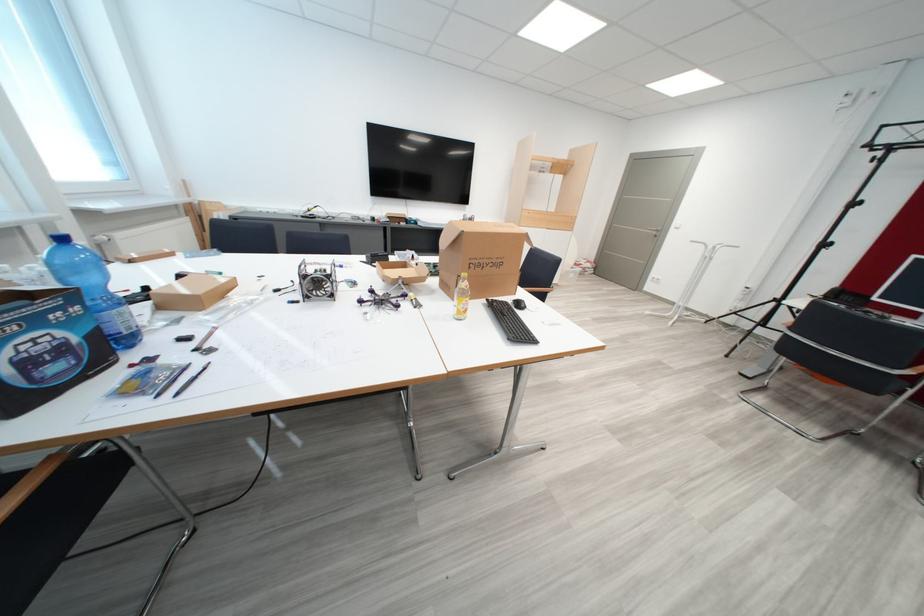
Which object does [480,257] point to?

It refers to a small open box.